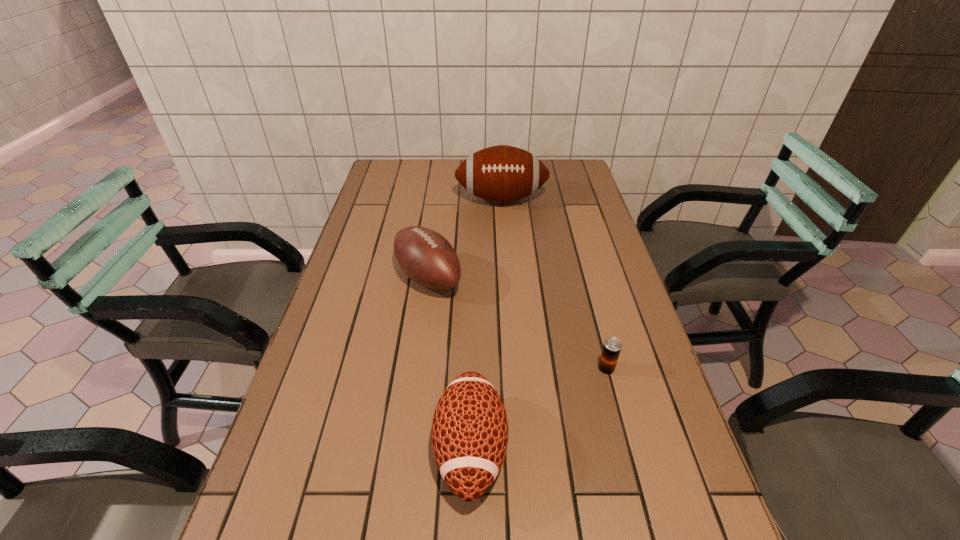
Where is `empty space that is in between the nearest object and the rightmost object`? This screenshot has height=540, width=960. empty space that is in between the nearest object and the rightmost object is located at coordinates (539, 409).

I want to click on free spot between the tallest object and the shortest object, so click(554, 284).

The image size is (960, 540). In order to click on vacant region between the third nearest object and the shortest object in this screenshot , I will do `click(517, 323)`.

I want to click on vacant region between the beer can and the second farthest object, so click(x=517, y=323).

What are the coordinates of `unoccupied area between the beer can and the tallest football` in the screenshot? It's located at (554, 284).

You are a GUI agent. You are given a task and a screenshot of the screen. Output one action in this format:
    pyautogui.click(x=<x>, y=<y>)
    Task: Click on the third closest object to the tallest football
    The image size is (960, 540).
    Given the screenshot: What is the action you would take?
    pyautogui.click(x=469, y=434)

Identify which object is the third closest to the farthest football. Please provide its 2D coordinates. Your answer should be formatted as a tuple, i.e. [(x, y)], where the tuple contains the x and y coordinates of a point satisfying the conditions above.

[(469, 434)]

Identify which football is located as the nearest to the nearest football. Please provide its 2D coordinates. Your answer should be formatted as a tuple, i.e. [(x, y)], where the tuple contains the x and y coordinates of a point satisfying the conditions above.

[(425, 256)]

The image size is (960, 540). Identify the location of football that is the second closest to the farthest football. (469, 434).

Find the location of a particular element. free spot that satisfies the following two spatial constraints: 1. on the back side of the nearest object; 2. on the left side of the third farthest object is located at coordinates (472, 368).